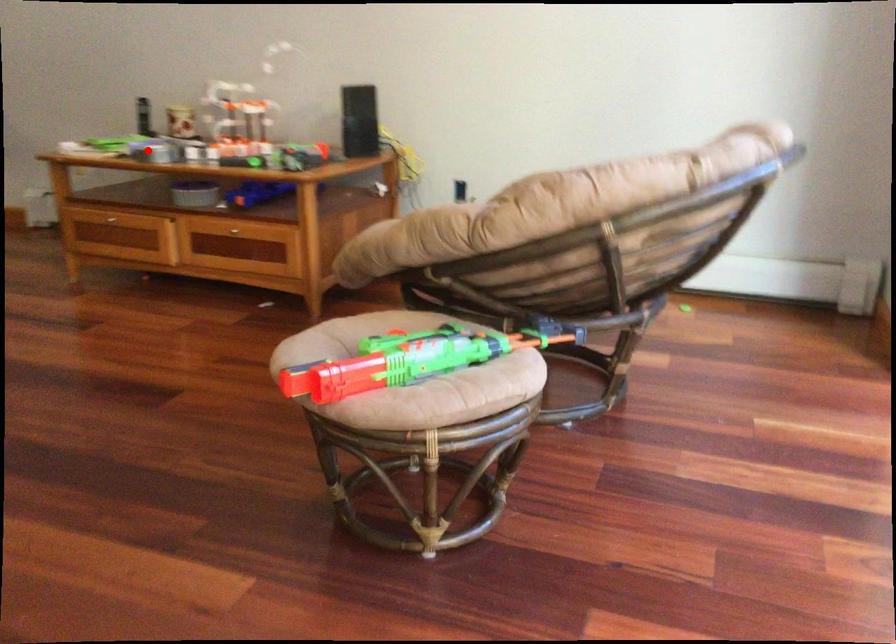
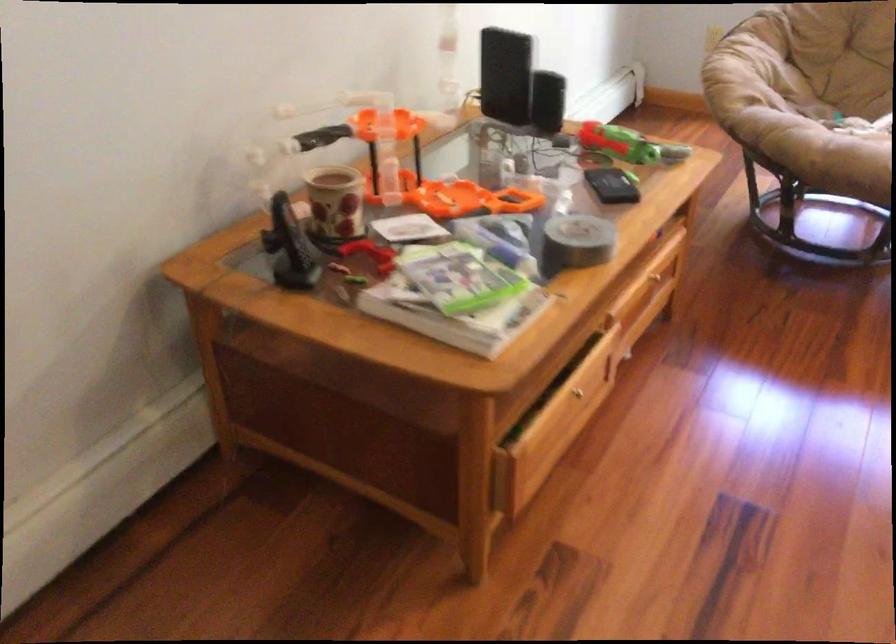
Find the pixel in the second image that matches the highlighted location in the first image.

(576, 242)